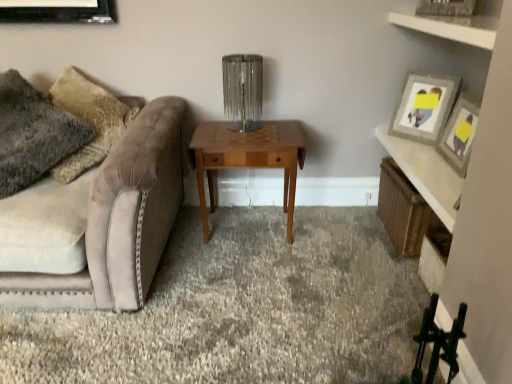
This screenshot has height=384, width=512. I want to click on vacant area to the left of clear glass table lamp at center, so click(210, 130).